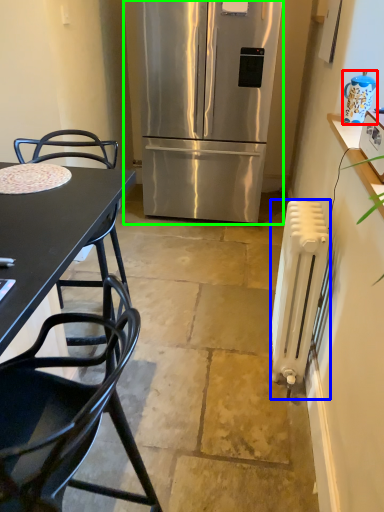
Question: Based on their relative distances, which object is farther from appliance (highlighted by a red box)? Choose from radiator (highlighted by a blue box) and refrigerator (highlighted by a green box).

Choices:
 (A) radiator
 (B) refrigerator

Answer: (B)